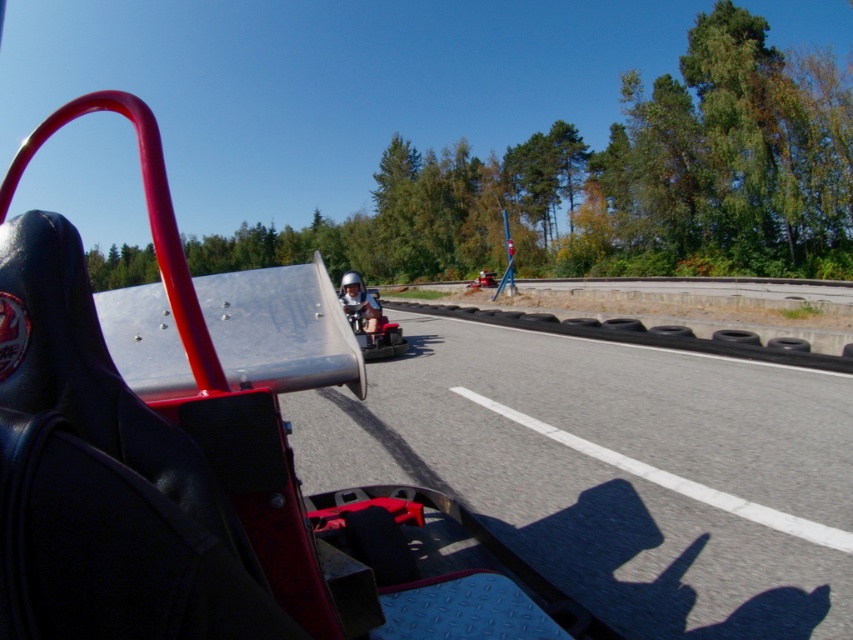
Can you confirm if smooth asphalt highway at center is thinner than shiny silver helmet at center?

Yes, smooth asphalt highway at center is thinner than shiny silver helmet at center.

Which is more to the right, smooth asphalt highway at center or shiny silver helmet at center?

From the viewer's perspective, smooth asphalt highway at center appears more on the right side.

In order to click on smooth asphalt highway at center in this screenshot , I will do `click(614, 470)`.